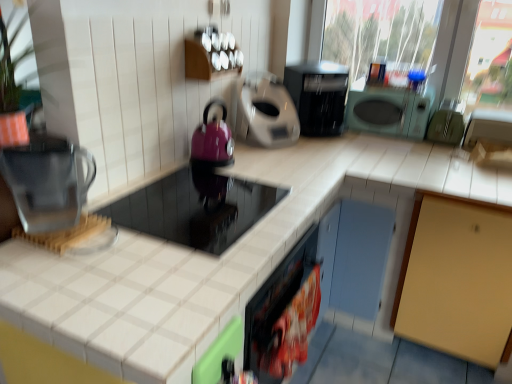
The image size is (512, 384). Identify the location of vacant space in front of black plastic toaster at upper center. (334, 150).